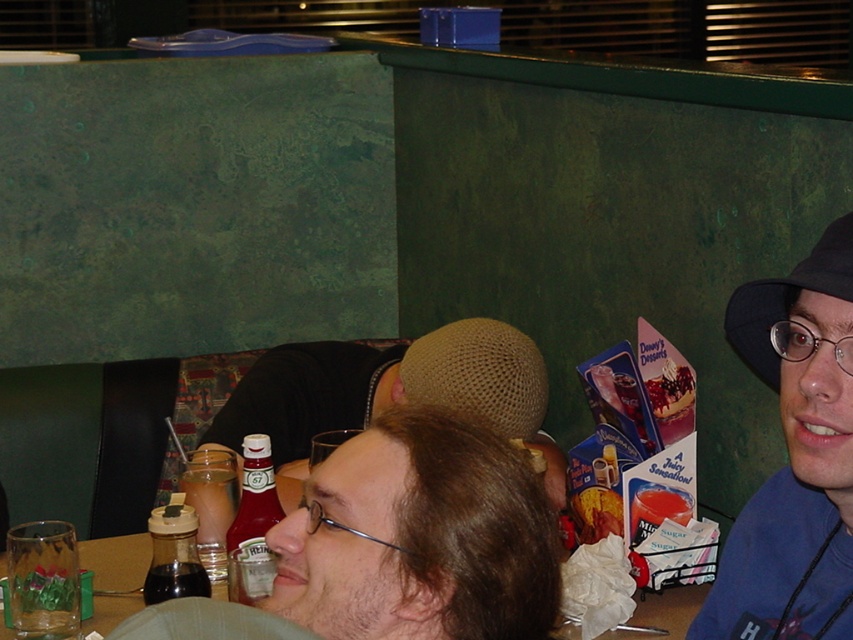
Is point (810, 284) positioned before point (679, 374)?

Yes, it is in front of point (679, 374).

Between point (763, 371) and point (651, 387), which one is positioned behind?

The point (651, 387) is more distant.

The width and height of the screenshot is (853, 640). Describe the element at coordinates (782, 296) in the screenshot. I see `black fabric baseball hat at right` at that location.

Where is `black fabric baseball hat at right`? black fabric baseball hat at right is located at coordinates (782, 296).

Which is below, blue fabric hat at right or translucent glass table at center?

Positioned lower is translucent glass table at center.

Which is more to the right, blue fabric hat at right or translucent glass table at center?

Positioned to the right is blue fabric hat at right.

The height and width of the screenshot is (640, 853). In order to click on blue fabric hat at right in this screenshot , I will do `click(793, 458)`.

Where is `blue fabric hat at right`? The image size is (853, 640). blue fabric hat at right is located at coordinates (793, 458).

Can you confirm if blue fabric hat at right is smaller than black fabric baseball hat at right?

No.

Does blue fabric hat at right appear over black fabric baseball hat at right?

Incorrect, blue fabric hat at right is not positioned above black fabric baseball hat at right.

Between point (755, 499) and point (849, 262), which one is positioned behind?

The point (755, 499) is behind.

Identify the location of blue fabric hat at right. This screenshot has width=853, height=640. (793, 458).